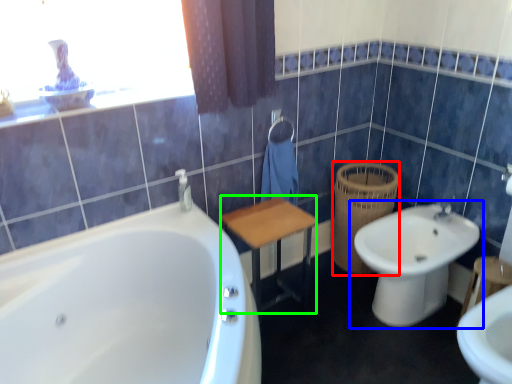
Question: Based on their relative distances, which object is nearer to basket (highlighted by a red box)? Choose from toilet (highlighted by a blue box) and vanity (highlighted by a green box).

Choices:
 (A) toilet
 (B) vanity

Answer: (A)